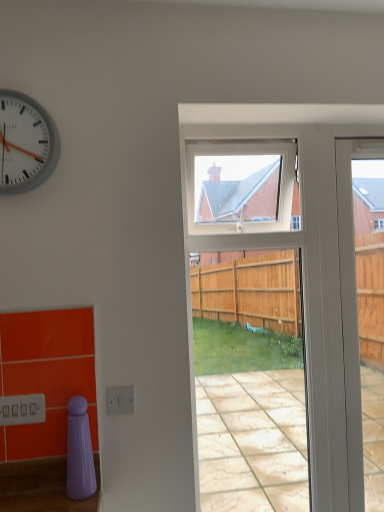
Question: Is point (26, 179) positioned closer to the camera than point (357, 389)?

Choices:
 (A) farther
 (B) closer

Answer: (B)

Question: Is white plastic clock at upper left in front of or behind white glossy door at right in the image?

Choices:
 (A) front
 (B) behind

Answer: (A)

Question: Estimate the real-world distances between objects in this image. Which object is closer to the white glossy door at right?

Choices:
 (A) white plastic clock at upper left
 (B) clear glass screen door at center

Answer: (B)

Question: Based on their relative distances, which object is farther from the clear glass screen door at center?

Choices:
 (A) white plastic clock at upper left
 (B) white glossy door at right

Answer: (A)